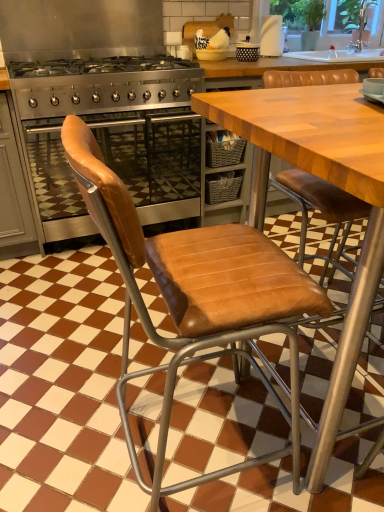
Question: From the image's perspective, is stainless steel gas stove at center on white matte paper towel at upper right?

Choices:
 (A) no
 (B) yes

Answer: (A)

Question: Does stainless steel gas stove at center lie behind white matte paper towel at upper right?

Choices:
 (A) no
 (B) yes

Answer: (A)

Question: Can you confirm if stainless steel gas stove at center is shorter than white matte paper towel at upper right?

Choices:
 (A) yes
 (B) no

Answer: (B)

Question: Is stainless steel gas stove at center far from white matte paper towel at upper right?

Choices:
 (A) yes
 (B) no

Answer: (A)

Question: Is stainless steel gas stove at center located outside white matte paper towel at upper right?

Choices:
 (A) yes
 (B) no

Answer: (A)

Question: Considering their positions, is stainless steel gas stove at center located in front of or behind transparent glass window screen at upper right?

Choices:
 (A) front
 (B) behind

Answer: (A)

Question: From the image's perspective, is stainless steel gas stove at center positioned above or below transparent glass window screen at upper right?

Choices:
 (A) below
 (B) above

Answer: (A)

Question: Considering the positions of stainless steel gas stove at center and transparent glass window screen at upper right in the image, is stainless steel gas stove at center taller or shorter than transparent glass window screen at upper right?

Choices:
 (A) tall
 (B) short

Answer: (A)

Question: Considering the positions of stainless steel gas stove at center and transparent glass window screen at upper right in the image, is stainless steel gas stove at center wider or thinner than transparent glass window screen at upper right?

Choices:
 (A) wide
 (B) thin

Answer: (A)

Question: From the image's perspective, is stainless steel gas stove at center above or below stainless steel oven at left?

Choices:
 (A) above
 (B) below

Answer: (A)

Question: Which is correct: stainless steel gas stove at center is inside stainless steel oven at left, or outside of it?

Choices:
 (A) outside
 (B) inside

Answer: (A)

Question: Relative to stainless steel oven at left, is stainless steel gas stove at center in front or behind?

Choices:
 (A) front
 (B) behind

Answer: (A)

Question: From a real-world perspective, relative to stainless steel oven at left, is stainless steel gas stove at center vertically above or below?

Choices:
 (A) above
 (B) below

Answer: (A)

Question: Is stainless steel oven at left spatially inside white matte paper towel at upper right, or outside of it?

Choices:
 (A) outside
 (B) inside

Answer: (A)

Question: From the image's perspective, relative to white matte paper towel at upper right, is stainless steel oven at left above or below?

Choices:
 (A) above
 (B) below

Answer: (B)